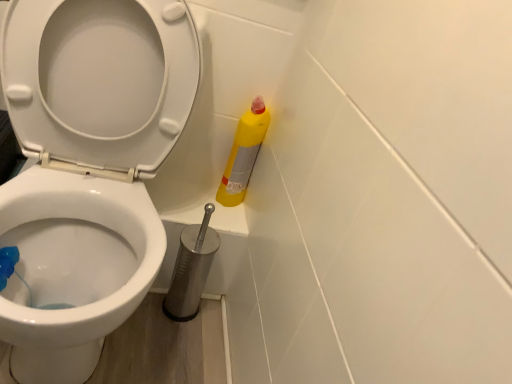
This screenshot has width=512, height=384. Describe the element at coordinates (88, 167) in the screenshot. I see `white glossy toilet at center` at that location.

Locate an element on the screen. The height and width of the screenshot is (384, 512). white glossy toilet at center is located at coordinates (88, 167).

Locate an element on the screen. The height and width of the screenshot is (384, 512). metallic silver toilet brush at lower center is located at coordinates (191, 269).

Considering the sizes of white glossy toilet at center and metallic silver toilet brush at lower center in the image, is white glossy toilet at center bigger or smaller than metallic silver toilet brush at lower center?

Clearly, white glossy toilet at center is larger in size than metallic silver toilet brush at lower center.

From the image's perspective, is white glossy toilet at center above metallic silver toilet brush at lower center?

Yes, from the image's perspective, white glossy toilet at center is on top of metallic silver toilet brush at lower center.

How different are the orientations of white glossy toilet at center and metallic silver toilet brush at lower center in degrees?

The angle between the facing direction of white glossy toilet at center and the facing direction of metallic silver toilet brush at lower center is 0.00146 degrees.

Can you confirm if white glossy toilet at center is taller than metallic silver toilet brush at lower center?

Correct, white glossy toilet at center is much taller as metallic silver toilet brush at lower center.

Is white glossy toilet at center outside of yellow matte bottle at right?

Yes, white glossy toilet at center is located beyond the bounds of yellow matte bottle at right.

Is yellow matte bottle at right at the back of white glossy toilet at center?

No.

Who is smaller, white glossy toilet at center or yellow matte bottle at right?

yellow matte bottle at right is smaller.

The image size is (512, 384). In order to click on cleaning product above the white glossy toilet at center (from the image's perspective) in this screenshot , I will do `click(243, 154)`.

Is yellow matte bottle at right directly adjacent to white glossy toilet at center?

No, yellow matte bottle at right is not with white glossy toilet at center.

Is yellow matte bottle at right not inside white glossy toilet at center?

Absolutely, yellow matte bottle at right is external to white glossy toilet at center.

Measure the distance between yellow matte bottle at right and white glossy toilet at center.

40.26 centimeters.

From the image's perspective, is yellow matte bottle at right located above or below white glossy toilet at center?

Clearly, from the image's perspective, yellow matte bottle at right is above white glossy toilet at center.

Measure the distance from metallic silver toilet brush at lower center to white glossy toilet at center.

metallic silver toilet brush at lower center and white glossy toilet at center are 11.91 inches apart.

Is metallic silver toilet brush at lower center smaller than white glossy toilet at center?

Indeed, metallic silver toilet brush at lower center has a smaller size compared to white glossy toilet at center.

Considering the positions of objects metallic silver toilet brush at lower center and white glossy toilet at center in the image provided, who is more to the right, metallic silver toilet brush at lower center or white glossy toilet at center?

metallic silver toilet brush at lower center.

From the picture: Is metallic silver toilet brush at lower center not near white glossy toilet at center?

Actually, metallic silver toilet brush at lower center and white glossy toilet at center are a little close together.

Between metallic silver toilet brush at lower center and yellow matte bottle at right, which one appears on the left side from the viewer's perspective?

metallic silver toilet brush at lower center.

Considering the sizes of metallic silver toilet brush at lower center and yellow matte bottle at right in the image, is metallic silver toilet brush at lower center taller or shorter than yellow matte bottle at right?

Considering their sizes, metallic silver toilet brush at lower center has more height than yellow matte bottle at right.

Which point is more forward, (206,226) or (263,113)?

The point (206,226) is closer.

Is metallic silver toilet brush at lower center wider than yellow matte bottle at right?

Yes.

From a real-world perspective, who is located higher, yellow matte bottle at right or metallic silver toilet brush at lower center?

yellow matte bottle at right is physically above.

Between yellow matte bottle at right and metallic silver toilet brush at lower center, which one has larger size?

metallic silver toilet brush at lower center is bigger.

Image resolution: width=512 pixels, height=384 pixels. In order to click on cleaning product behind the metallic silver toilet brush at lower center in this screenshot , I will do click(243, 154).

From the image's perspective, is yellow matte bottle at right above or below metallic silver toilet brush at lower center?

Clearly, from the image's perspective, yellow matte bottle at right is above metallic silver toilet brush at lower center.

In the image, there is a white glossy toilet at center. Identify the location of brush below it (from a real-world perspective). (191, 269).

In the image, there is a white glossy toilet at center. Identify the location of cleaning product above it (from the image's perspective). This screenshot has height=384, width=512. (243, 154).

Looking at the image, which one is located closer to metallic silver toilet brush at lower center, white glossy toilet at center or yellow matte bottle at right?

Based on the image, yellow matte bottle at right appears to be nearer to metallic silver toilet brush at lower center.

Looking at the image, which one is located closer to white glossy toilet at center, yellow matte bottle at right or metallic silver toilet brush at lower center?

Among the two, metallic silver toilet brush at lower center is located nearer to white glossy toilet at center.

When comparing their distances from metallic silver toilet brush at lower center, does yellow matte bottle at right or white glossy toilet at center seem closer?

yellow matte bottle at right.

When comparing their distances from white glossy toilet at center, does metallic silver toilet brush at lower center or yellow matte bottle at right seem closer?

The object closer to white glossy toilet at center is metallic silver toilet brush at lower center.

Looking at the image, which one is located further to yellow matte bottle at right, metallic silver toilet brush at lower center or white glossy toilet at center?

white glossy toilet at center.

Considering their positions, is white glossy toilet at center positioned closer to yellow matte bottle at right than metallic silver toilet brush at lower center?

metallic silver toilet brush at lower center is positioned closer to the anchor yellow matte bottle at right.

At what (x,y) coordinates should I click in order to perform the action: click on brush between white glossy toilet at center and yellow matte bottle at right in the front-back direction. Please return your answer as a coordinate pair (x, y). Image resolution: width=512 pixels, height=384 pixels. Looking at the image, I should click on (191, 269).